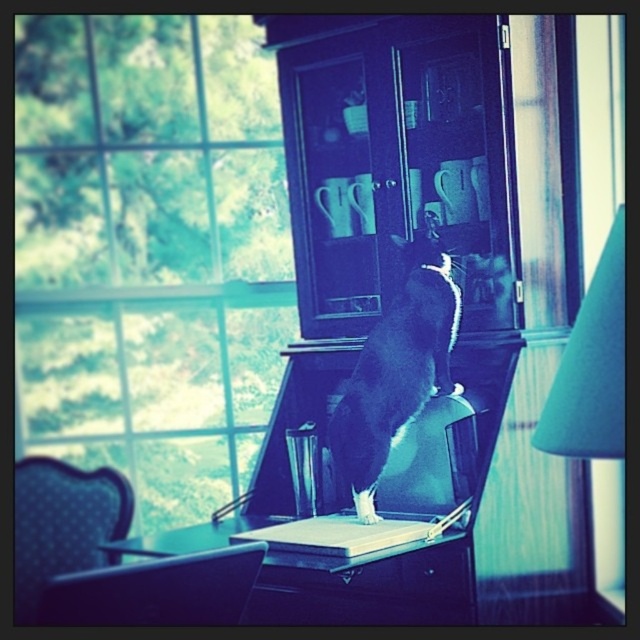
Between smooth wooden table at center and black fur cat at center, which one has less height?

With less height is smooth wooden table at center.

Is smooth wooden table at center closer to camera compared to black fur cat at center?

Yes, it is.

This screenshot has height=640, width=640. Describe the element at coordinates (369, 586) in the screenshot. I see `smooth wooden table at center` at that location.

At what (x,y) coordinates should I click in order to perform the action: click on smooth wooden table at center. Please return your answer as a coordinate pair (x, y). Looking at the image, I should click on (369, 586).

The width and height of the screenshot is (640, 640). What do you see at coordinates (396, 371) in the screenshot?
I see `black fur cat at center` at bounding box center [396, 371].

Between black fur cat at center and blue dotted fabric chair at lower left, which one has more height?

Result: black fur cat at center is taller.

Who is more distant from viewer, (332, 422) or (93, 502)?

Point (93, 502)

This screenshot has width=640, height=640. I want to click on black fur cat at center, so click(x=396, y=371).

Is black fur cat at center smaller than black glossy laptop at center?

Yes, black fur cat at center is smaller than black glossy laptop at center.

Who is lower down, black fur cat at center or black glossy laptop at center?

black glossy laptop at center is below.

Between point (372, 483) and point (435, 412), which one is positioned in front?

Positioned in front is point (372, 483).

Where is `black fur cat at center`? The image size is (640, 640). black fur cat at center is located at coordinates (396, 371).